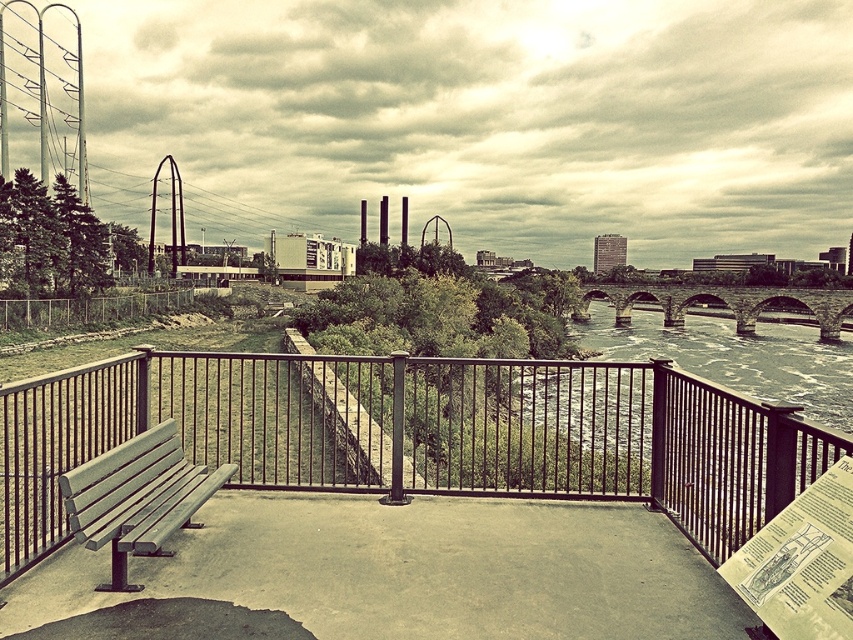
Who is more distant from viewer, [228,465] or [747,300]?

Positioned behind is point [747,300].

I want to click on wooden bench at lower left, so click(x=137, y=497).

Between point (97, 508) and point (657, 289), which one is positioned in front?

Point (97, 508) is more forward.

Identify the location of wooden bench at lower left. (137, 497).

Is metal at left thinner than stone arch bridge at right?

Yes.

Is metal at left taller than stone arch bridge at right?

Incorrect, metal at left's height is not larger of stone arch bridge at right's.

Does point (486, 467) come in front of point (606, 291)?

Yes, point (486, 467) is closer to viewer.

This screenshot has width=853, height=640. I want to click on metal at left, so click(x=416, y=435).

Does point (346, 486) come behind point (169, 440)?

Yes, it is.

Who is more distant from viewer, (144,376) or (129,444)?

Positioned behind is point (144,376).

Which is in front, point (659, 508) or point (128, 461)?

Point (128, 461)

You are a GUI agent. You are given a task and a screenshot of the screen. Output one action in this format:
    pyautogui.click(x=<x>, y=<y>)
    Task: Click on the metal at left
    The height and width of the screenshot is (640, 853).
    Given the screenshot: What is the action you would take?
    pyautogui.click(x=416, y=435)